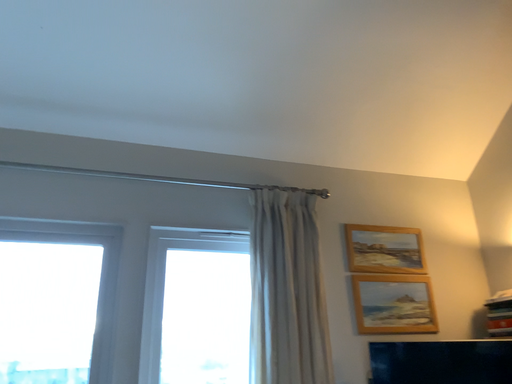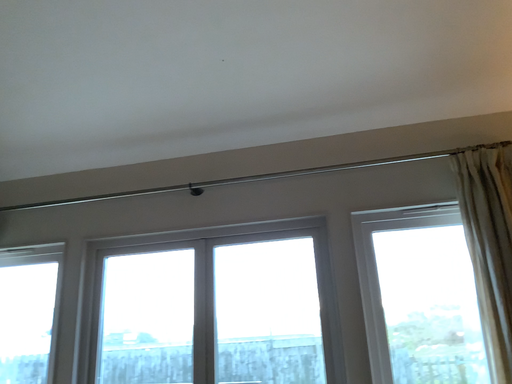
Question: How did the camera likely rotate when shooting the video?

Choices:
 (A) rotated right
 (B) rotated left

Answer: (B)